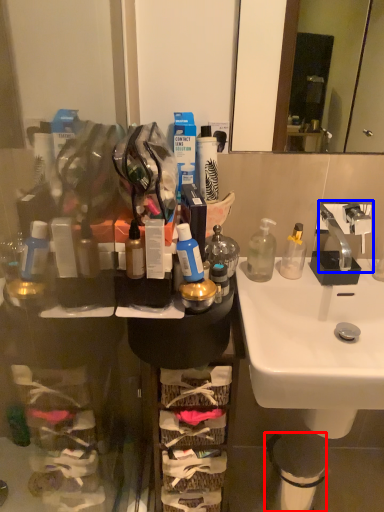
Question: Which point is closer to the camera, trash bin/can (highlighted by a red box) or tap (highlighted by a blue box)?

Choices:
 (A) trash bin/can
 (B) tap

Answer: (B)